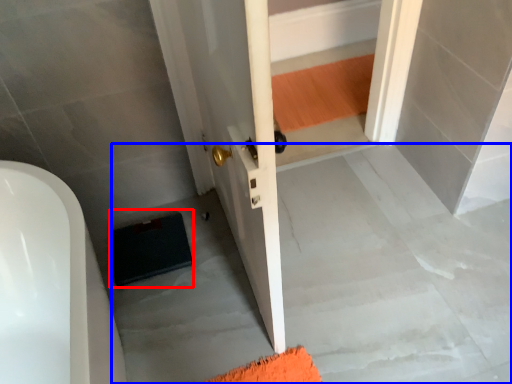
Question: Which object appears farthest to the camera in this image, doormat (highlighted by a red box) or concrete (highlighted by a blue box)?

Choices:
 (A) doormat
 (B) concrete

Answer: (A)